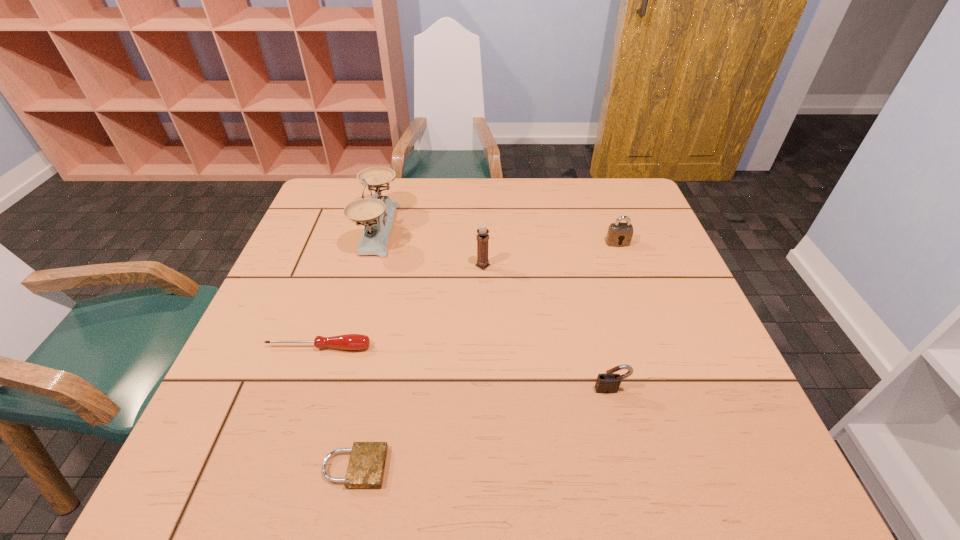
At what (x,y) coordinates should I click in order to perform the action: click on blank region between the candle holder and the rightmost padlock. Please return your answer as a coordinate pair (x, y). The height and width of the screenshot is (540, 960). Looking at the image, I should click on (550, 254).

You are a GUI agent. You are given a task and a screenshot of the screen. Output one action in this format:
    pyautogui.click(x=<x>, y=<y>)
    Task: Click on the free space between the third farthest object and the tallest object
    The image size is (960, 540).
    Given the screenshot: What is the action you would take?
    pyautogui.click(x=430, y=247)

Image resolution: width=960 pixels, height=540 pixels. I want to click on vacant space in between the tallest object and the fifth tallest object, so click(x=348, y=288).

Where is `free space between the rightmost padlock and the shortest object`? This screenshot has width=960, height=540. free space between the rightmost padlock and the shortest object is located at coordinates point(486,355).

Find the location of a particular element. The height and width of the screenshot is (540, 960). free space between the rightmost object and the second tallest object is located at coordinates (550, 254).

Locate an element on the screen. The image size is (960, 540). vacant space in between the fifth tallest object and the fourth nearest object is located at coordinates (x=400, y=306).

You are a GUI agent. You are given a task and a screenshot of the screen. Output one action in this format:
    pyautogui.click(x=<x>, y=<y>)
    Task: Click on the empty space that is in between the third nearest object and the scale
    The width and height of the screenshot is (960, 540).
    Given the screenshot: What is the action you would take?
    pyautogui.click(x=348, y=288)

Where is `the second closest object relative to the second nearest padlock`? Image resolution: width=960 pixels, height=540 pixels. the second closest object relative to the second nearest padlock is located at coordinates (367, 461).

Select which object appears as the closest to the third farthest object. Please provide its 2D coordinates. Your answer should be formatted as a tuple, i.e. [(x, y)], where the tuple contains the x and y coordinates of a point satisfying the conditions above.

[(378, 211)]

Identify which padlock is located as the third nearest to the tallest object. Please provide its 2D coordinates. Your answer should be formatted as a tuple, i.e. [(x, y)], where the tuple contains the x and y coordinates of a point satisfying the conditions above.

[(607, 383)]